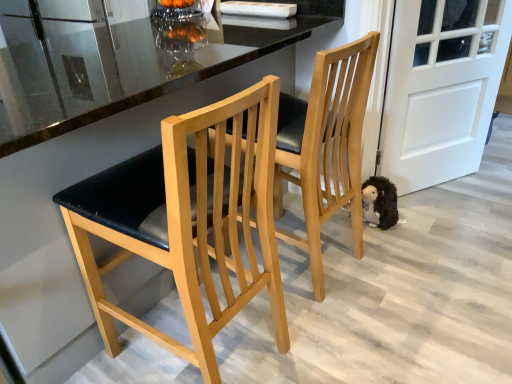
Question: Is the position of fuzzy brown plush at lower right more distant than that of white matte door at right?

Choices:
 (A) no
 (B) yes

Answer: (B)

Question: Does fuzzy brown plush at lower right have a lesser height compared to white matte door at right?

Choices:
 (A) no
 (B) yes

Answer: (B)

Question: From a real-world perspective, is fuzzy brown plush at lower right over white matte door at right?

Choices:
 (A) yes
 (B) no

Answer: (B)

Question: Considering the relative sizes of fuzzy brown plush at lower right and white matte door at right in the image provided, is fuzzy brown plush at lower right wider than white matte door at right?

Choices:
 (A) no
 (B) yes

Answer: (B)

Question: Is fuzzy brown plush at lower right at the right side of white matte door at right?

Choices:
 (A) no
 (B) yes

Answer: (A)

Question: In terms of size, does matte black seat at center, acting as the first chair starting from the left, appear bigger or smaller than fuzzy brown plush at lower right?

Choices:
 (A) small
 (B) big

Answer: (B)

Question: From the image's perspective, is matte black seat at center, acting as the second chair starting from the right, above or below fuzzy brown plush at lower right?

Choices:
 (A) above
 (B) below

Answer: (B)

Question: Is matte black seat at center, acting as the second chair starting from the right, spatially inside fuzzy brown plush at lower right, or outside of it?

Choices:
 (A) outside
 (B) inside

Answer: (A)

Question: Is point (196, 289) positioned closer to the camera than point (366, 221)?

Choices:
 (A) farther
 (B) closer

Answer: (B)

Question: Relative to matte wood chair at center, placed as the second chair when sorted from left to right, is fuzzy brown plush at lower right in front or behind?

Choices:
 (A) behind
 (B) front

Answer: (A)

Question: Is point (390, 201) positioned closer to the camera than point (356, 251)?

Choices:
 (A) closer
 (B) farther

Answer: (B)

Question: Is fuzzy brown plush at lower right bigger or smaller than matte wood chair at center, placed as the second chair when sorted from left to right?

Choices:
 (A) big
 (B) small

Answer: (B)

Question: From the image's perspective, is fuzzy brown plush at lower right above or below matte wood chair at center, which is counted as the 1th chair, starting from the right?

Choices:
 (A) above
 (B) below

Answer: (B)

Question: Based on their positions, is fuzzy brown plush at lower right located to the left or right of white matte door at right?

Choices:
 (A) right
 (B) left

Answer: (B)

Question: Looking at their shapes, would you say fuzzy brown plush at lower right is wider or thinner than white matte door at right?

Choices:
 (A) wide
 (B) thin

Answer: (A)